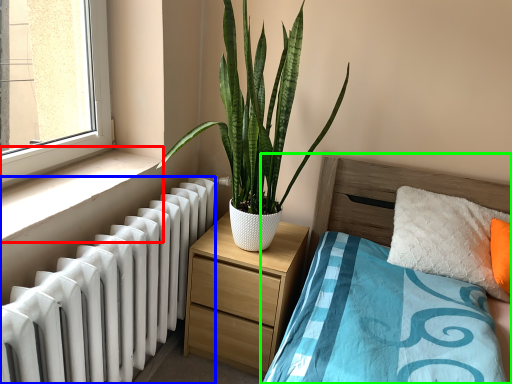
Question: Based on their relative distances, which object is nearer to window sill (highlighted by a red box)? Choose from radiator (highlighted by a blue box) and bed (highlighted by a green box).

Choices:
 (A) radiator
 (B) bed

Answer: (A)